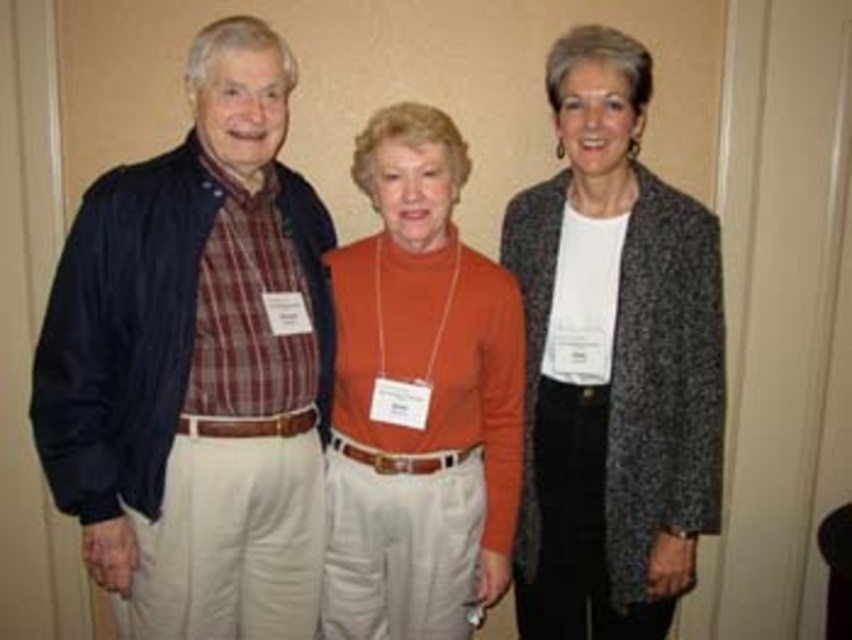
Who is taller, matte black jacket at left or speckled woolen cardigan at center?

speckled woolen cardigan at center

Does point (168, 605) come in front of point (531, 234)?

That is True.

Between point (98, 564) and point (576, 481), which one is positioned in front?

Point (98, 564) is more forward.

Locate an element on the screen. matte black jacket at left is located at coordinates pos(197,364).

From the picture: Can you confirm if matte black jacket at left is thinner than orange turtleneck sweater at center?

No.

Between matte black jacket at left and orange turtleneck sweater at center, which one is positioned lower?

orange turtleneck sweater at center

Who is more forward, (x=37, y=404) or (x=371, y=168)?

Point (x=37, y=404)

The image size is (852, 640). What are the coordinates of `matte black jacket at left` in the screenshot? It's located at (197, 364).

Is speckled woolen cardigan at center bigger than orange turtleneck sweater at center?

Correct, speckled woolen cardigan at center is larger in size than orange turtleneck sweater at center.

Is speckled woolen cardigan at center above orange turtleneck sweater at center?

Correct, speckled woolen cardigan at center is located above orange turtleneck sweater at center.

Is point (661, 282) closer to camera compared to point (416, 525)?

That is True.

Locate an element on the screen. speckled woolen cardigan at center is located at coordinates (613, 362).